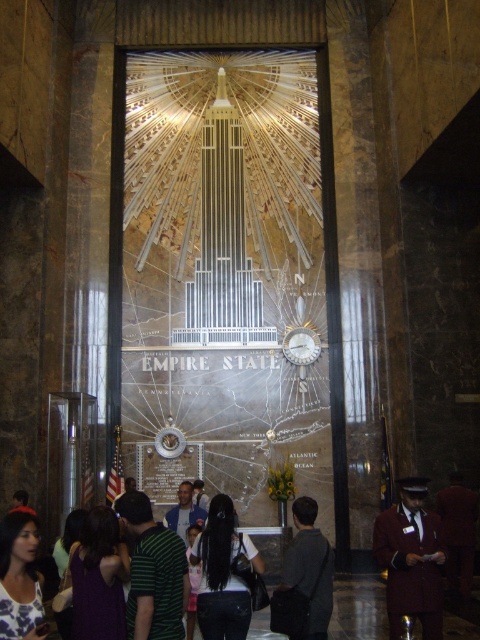
Between green striped shirt at center and black fabric at center, which one has more height?

Standing taller between the two is black fabric at center.

Is green striped shirt at center bigger than black fabric at center?

Actually, green striped shirt at center might be smaller than black fabric at center.

Is point (142, 637) less distant than point (228, 560)?

Yes, point (142, 637) is closer to viewer.

At what (x,y) coordinates should I click in order to perform the action: click on green striped shirt at center. Please return your answer as a coordinate pair (x, y). Looking at the image, I should click on (153, 572).

Does black fabric at center appear under white floral blouse at lower left?

Incorrect, black fabric at center is not positioned below white floral blouse at lower left.

Can you confirm if black fabric at center is positioned above white floral blouse at lower left?

Indeed, black fabric at center is positioned over white floral blouse at lower left.

The image size is (480, 640). Identify the location of black fabric at center. (223, 573).

Which of these two, blue fabric shirt at center or white glossy clock at center, stands taller?

white glossy clock at center

Which of these two, blue fabric shirt at center or white glossy clock at center, stands shorter?

With less height is blue fabric shirt at center.

In order to click on blue fabric shirt at center in this screenshot , I will do `click(184, 512)`.